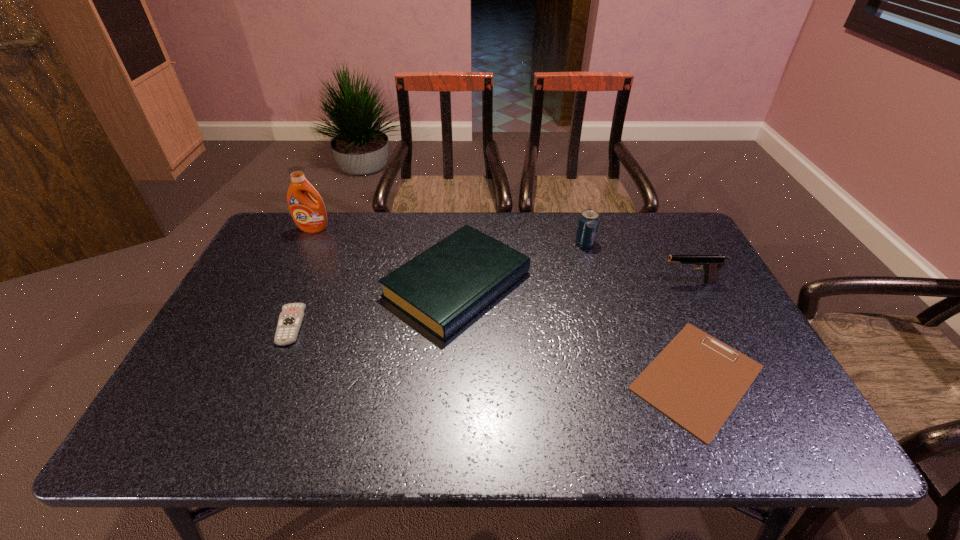
In the image, there is a desktop. What are the coordinates of `free space at the far left corner` in the screenshot? It's located at (287, 238).

What are the coordinates of `vacant space at the near right corner` in the screenshot? It's located at (742, 423).

Where is `vacant region between the pistol and the pop soda`? This screenshot has width=960, height=540. vacant region between the pistol and the pop soda is located at coordinates (637, 262).

At what (x,y) coordinates should I click in order to perform the action: click on empty space that is in between the remote control and the clipboard. Please return your answer as a coordinate pair (x, y). Looking at the image, I should click on (493, 352).

What are the coordinates of `vacant area that lies between the shortest object and the detergent` in the screenshot? It's located at 505,303.

Where is `vacant point located between the third object from left to right and the shortest object`? The image size is (960, 540). vacant point located between the third object from left to right and the shortest object is located at coordinates (577, 330).

Identify the location of vacant space in between the fifth tallest object and the fourth tallest object. This screenshot has height=540, width=960. (373, 305).

Where is `object that is the fourth closest to the pop soda`? This screenshot has width=960, height=540. object that is the fourth closest to the pop soda is located at coordinates (309, 215).

Locate an element on the screen. object identified as the fifth closest to the pop soda is located at coordinates (290, 319).

You are a GUI agent. You are given a task and a screenshot of the screen. Output one action in this format:
    pyautogui.click(x=<x>, y=<y>)
    Task: Click on the vacant space that satisfies the following two spatial constraints: 1. on the front-facing side of the farthest object; 2. on the right side of the pop soda
    The width and height of the screenshot is (960, 540).
    Given the screenshot: What is the action you would take?
    pyautogui.click(x=306, y=242)